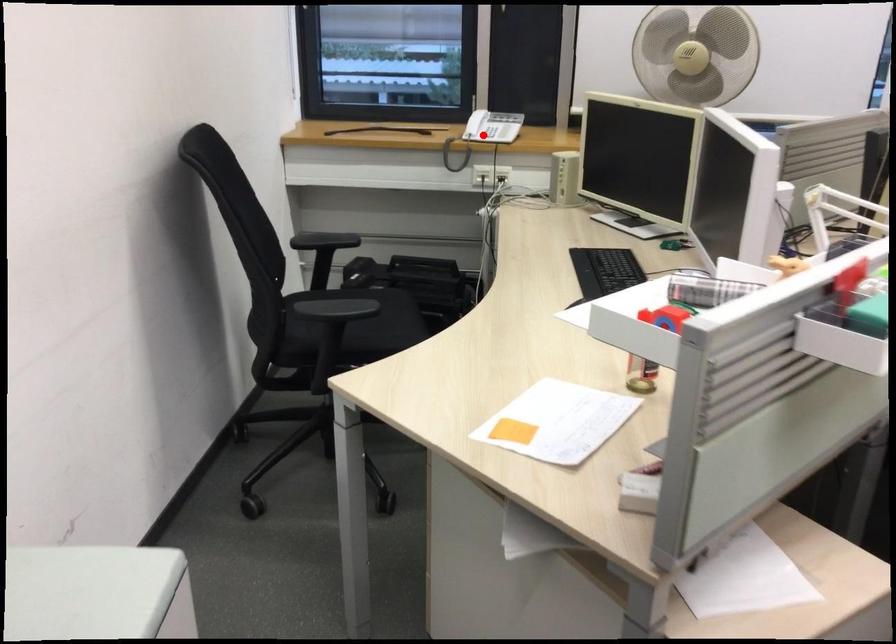
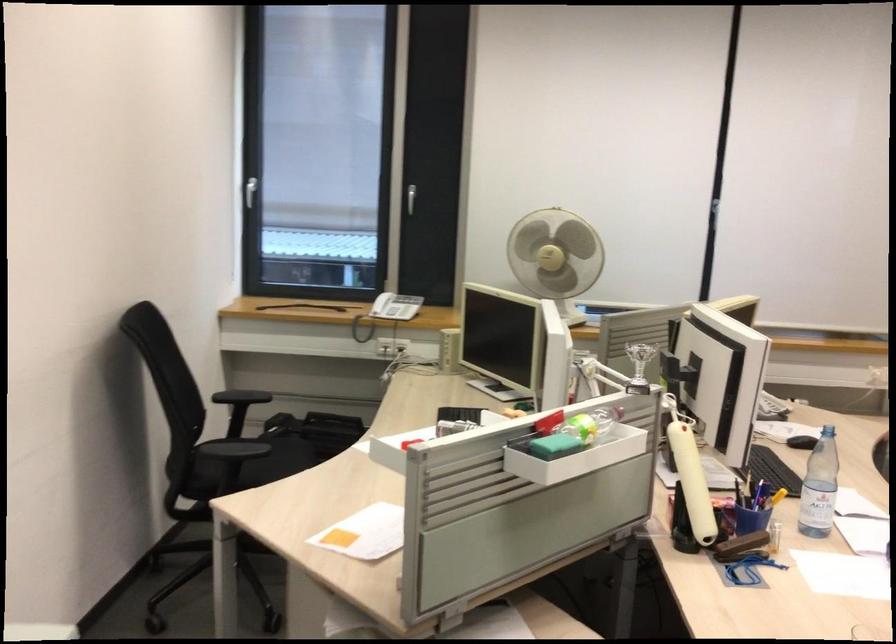
Find the pixel in the second image that matches the highlighted location in the first image.

(386, 312)